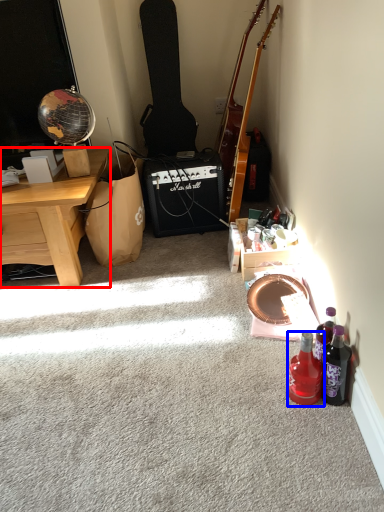
Question: Which of the following is the closest to the observer, desk (highlighted by a red box) or bottle (highlighted by a blue box)?

Choices:
 (A) desk
 (B) bottle

Answer: (B)